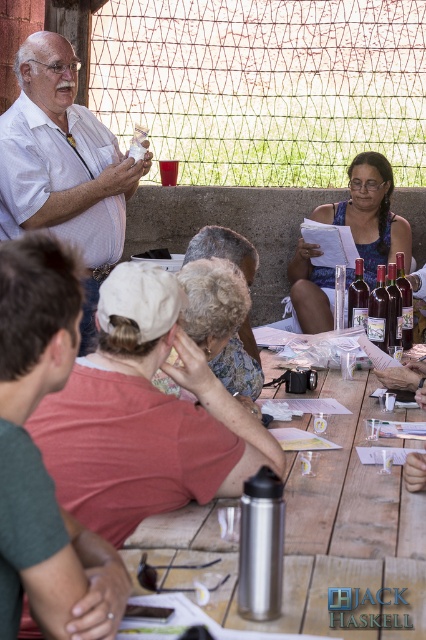
You are standing in front of the wooden table at the outdoor gathering. There are two points marked on the table surface. The first point is at coordinates point (383,548) and the second point is at point (69,252). Which point is closer to you?

Point (69,252) is closer to you because it is nearer to the camera compared to point (383,548), which is further away.

Based on the scene description, where is the wooden table located? Please provide coordinates in the format of a point like point (322, 531).

The wooden table at center is located at point (322, 531).

You are standing at the origin point in the image. Where is the wooden table at center located in terms of coordinates?

The wooden table at center is located at coordinates point (322, 531).